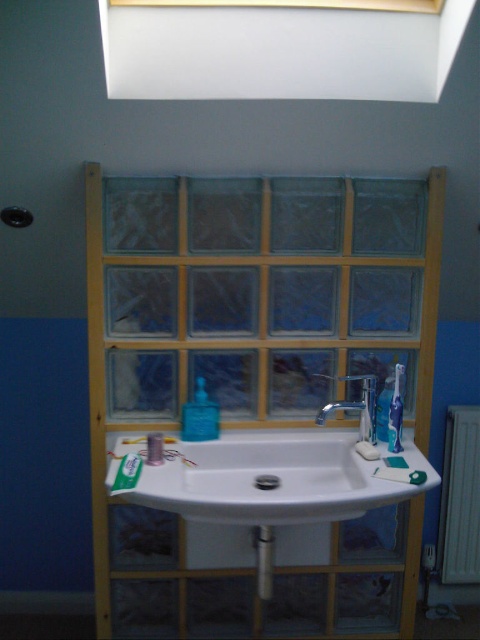
Question: Which point appears farthest from the camera in this image?

Choices:
 (A) (190, 472)
 (B) (397, 433)
 (C) (350, 376)

Answer: (C)

Question: Estimate the real-world distances between objects in this image. Which object is closer to the white plastic toothpaste at center?

Choices:
 (A) white matte soap at sink
 (B) translucent plastic soap dispenser at sink
 (C) green matte toothpaste at lower left
 (D) white ceramic sink at center

Answer: (C)

Question: Does green matte toothpaste at lower left appear over white plastic toothpaste at center?

Choices:
 (A) no
 (B) yes

Answer: (A)

Question: Estimate the real-world distances between objects in this image. Which object is farther from the white ceramic sink at center?

Choices:
 (A) white matte soap at sink
 (B) white matte toothpaste at center
 (C) clear glass window at center
 (D) translucent plastic soap dispenser at sink

Answer: (B)

Question: Can you confirm if white matte toothpaste at center is thinner than green matte toothpaste at lower left?

Choices:
 (A) no
 (B) yes

Answer: (B)

Question: Can you confirm if clear glass window at center is positioned to the right of silver metallic faucet at center?

Choices:
 (A) yes
 (B) no

Answer: (B)